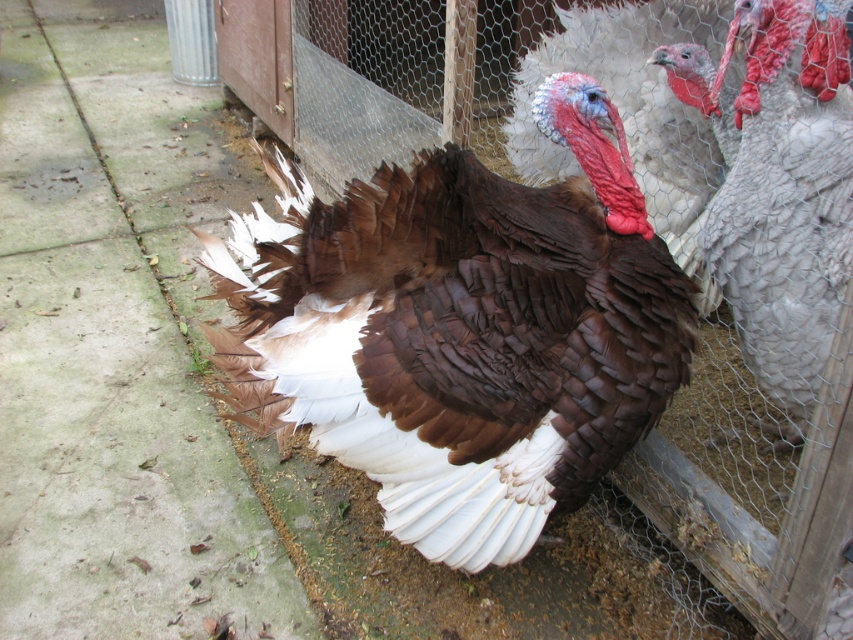
Question: Which point is closer to the camera taking this photo?

Choices:
 (A) (799, 259)
 (B) (465, 152)

Answer: (B)

Question: Among these objects, which one is nearest to the camera?

Choices:
 (A) brown glossy turkey at center
 (B) white feathered turkey at right

Answer: (A)

Question: Can you confirm if brown glossy turkey at center is smaller than white feathered turkey at right?

Choices:
 (A) no
 (B) yes

Answer: (A)

Question: Can you confirm if brown glossy turkey at center is thinner than white feathered turkey at right?

Choices:
 (A) yes
 (B) no

Answer: (B)

Question: Which object appears farthest from the camera in this image?

Choices:
 (A) white feathered turkey at right
 (B) brown glossy turkey at center

Answer: (A)

Question: In this image, where is brown glossy turkey at center located relative to white feathered turkey at right?

Choices:
 (A) above
 (B) below

Answer: (B)